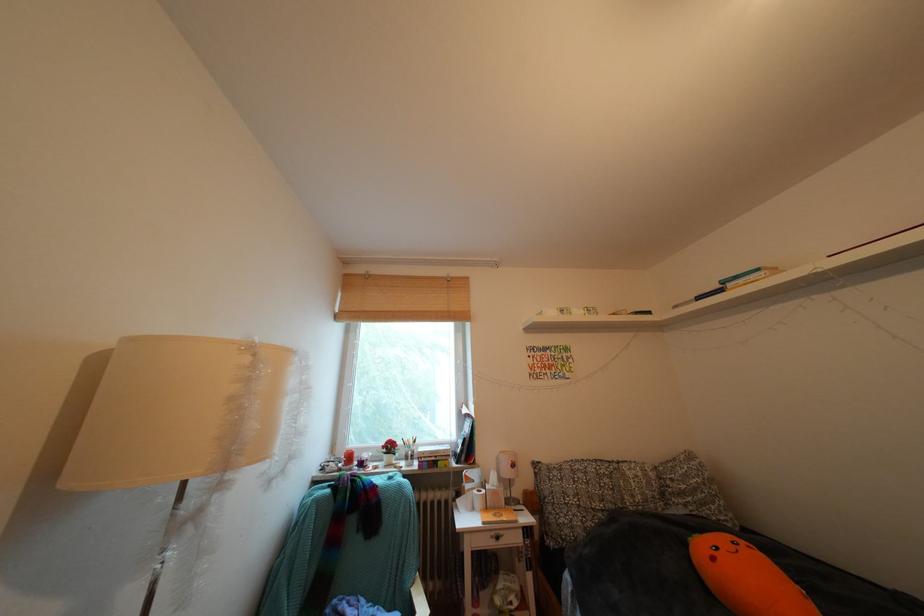
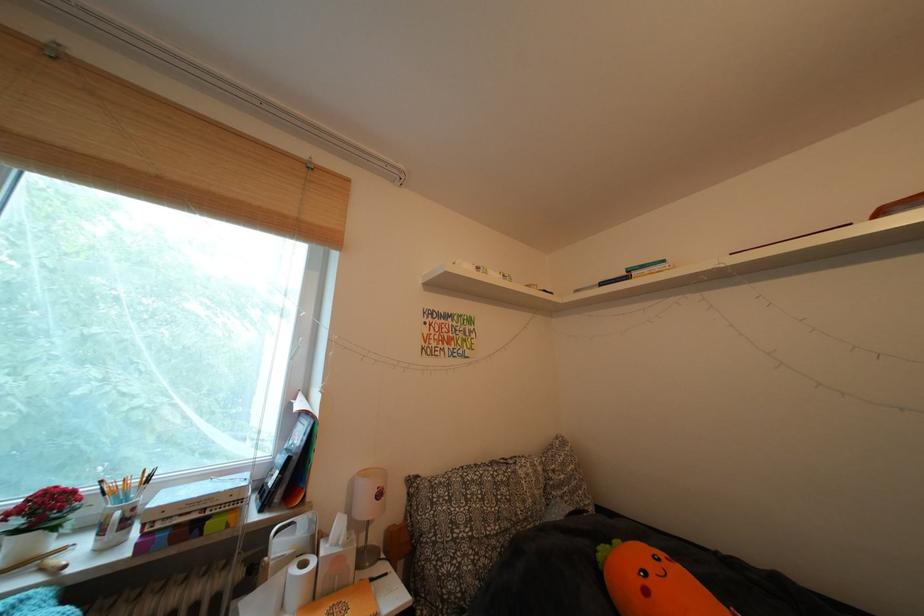
In the second image, find the point that corresponds to [505,498] in the first image.

(346, 565)